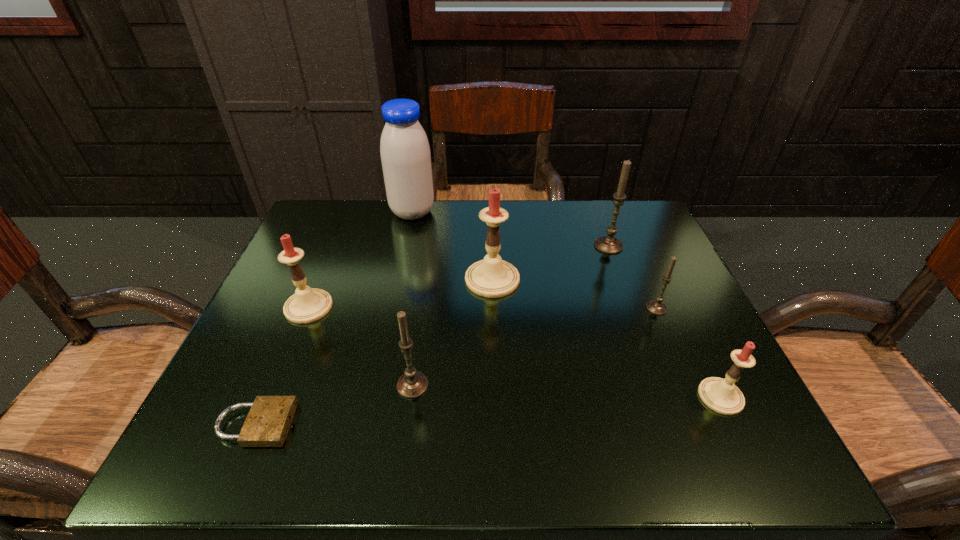
I want to click on free space that is in between the leftmost candle and the padlock, so click(282, 366).

Find the location of `free space between the leftmost gray candle and the tallest object`. free space between the leftmost gray candle and the tallest object is located at coordinates (413, 299).

Find the location of a particular element. Image resolution: width=960 pixels, height=540 pixels. empty space that is in between the smallest gray candle and the nearest red candle is located at coordinates (688, 352).

Identify the location of empty space between the farthest gray candle and the rightmost red candle. This screenshot has height=540, width=960. (664, 321).

What are the coordinates of `free space between the padlock and the third candle from left to right` in the screenshot? It's located at (373, 352).

Locate an element on the screen. This screenshot has width=960, height=540. vacant space that's between the tallest object and the nearest red candle is located at coordinates tap(566, 305).

Where is `free point between the nearest red candle and the leftmost red candle`? The image size is (960, 540). free point between the nearest red candle and the leftmost red candle is located at coordinates (515, 352).

Locate an element on the screen. The width and height of the screenshot is (960, 540). free point between the shortest object and the leftmost candle is located at coordinates (282, 366).

The height and width of the screenshot is (540, 960). I want to click on free space that is in between the shortest object and the rightmost red candle, so click(488, 410).

Find the location of a particular element. object that is the seventh closest to the tallest object is located at coordinates (721, 395).